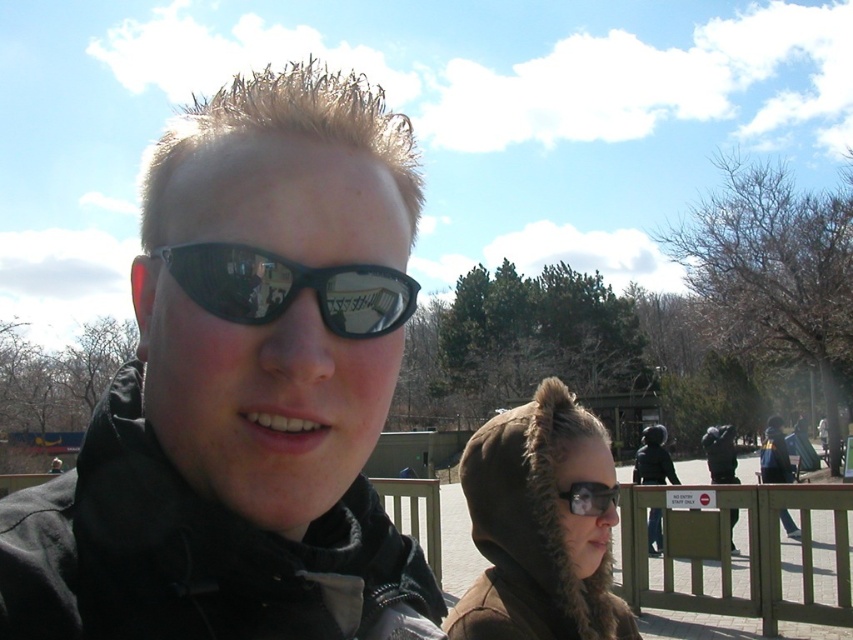
Does point (509, 410) lie in front of point (775, 438)?

That is True.

Which is above, brown fur-lined hood at center or brown fur-lined coat at lower right?

brown fur-lined hood at center is higher up.

Identify the location of brown fur-lined hood at center. Image resolution: width=853 pixels, height=640 pixels. click(x=538, y=525).

Is brown fur-lined hood at center thinner than wooden fence at lower right?

Indeed, brown fur-lined hood at center has a lesser width compared to wooden fence at lower right.

Is the position of brown fur-lined hood at center more distant than that of wooden fence at lower right?

That is False.

Which is behind, point (531, 561) or point (846, 506)?

The point (846, 506) is behind.

In order to click on brown fur-lined hood at center in this screenshot , I will do `click(538, 525)`.

Does brown fur-lined coat at lower right have a lesser height compared to matte black goggles at center?

Incorrect, brown fur-lined coat at lower right's height does not fall short of matte black goggles at center's.

Does brown fur-lined coat at lower right have a greater height compared to matte black goggles at center?

Indeed, brown fur-lined coat at lower right has a greater height compared to matte black goggles at center.

I want to click on brown fur-lined coat at lower right, so pos(775,454).

I want to click on brown fur-lined coat at lower right, so click(775, 454).